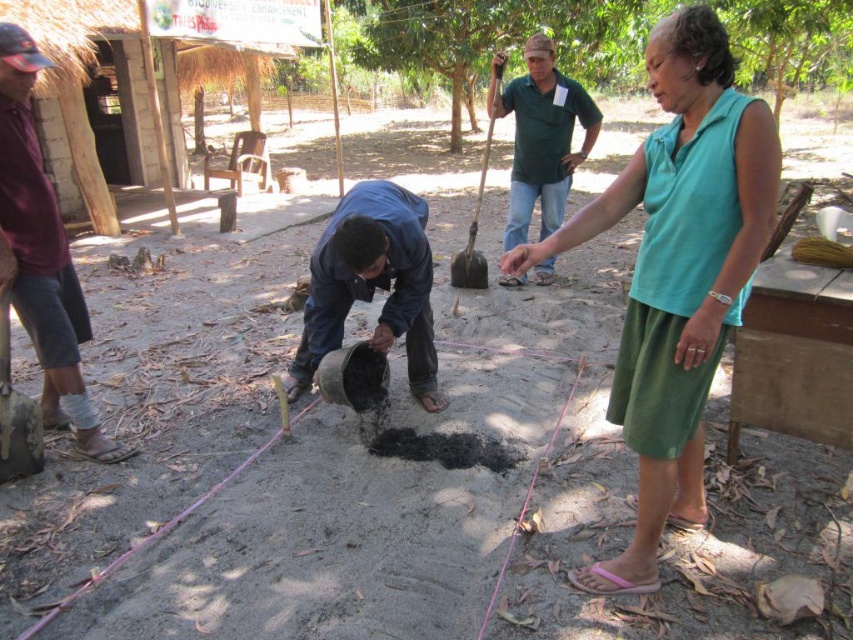
You are a construction worker observing the scene. You need to place a 1.2 meter wide equipment between the black matte cement at center and the teal fabric shirt at center. Is there enough space?

The black matte cement at center is wider than the teal fabric shirt at center. However, the exact width difference isn not specified, so it is uncertain if the 1.2 meter wide equipment can fit between them without more precise measurements.

You are a construction worker observing the scene. You see the black matte cement at center and the teal fabric shirt at center. Which object is positioned lower in the image?

The black matte cement at center is located below the teal fabric shirt at center, so it is positioned lower in the image.

You are standing in the outdoor scene and want to place a small flag at the closest point between point A at point (579,632) and point B at point (675,452). Which point should you choose?

Point A at point (579,632) is closer to the viewer than point B at point (675,452), so you should place the flag at point A.